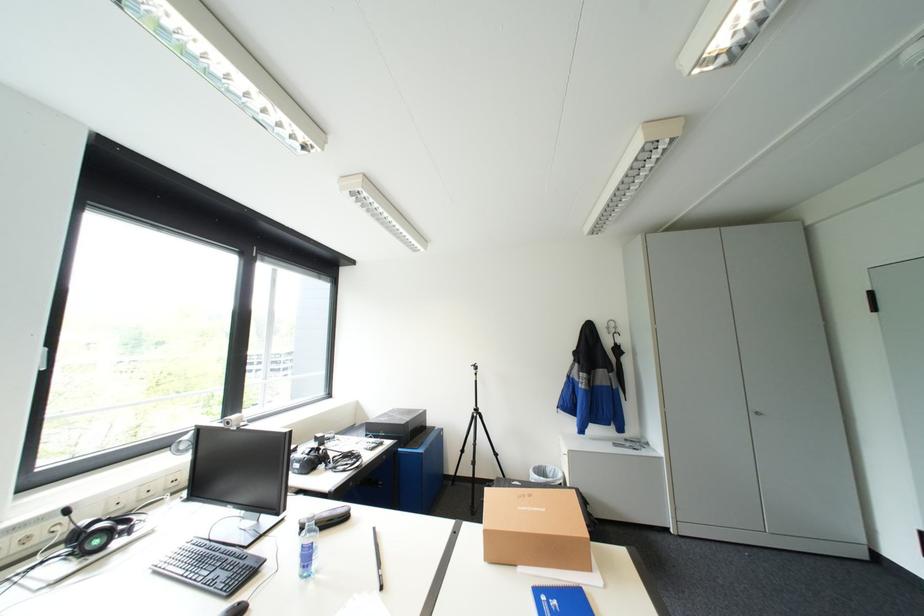
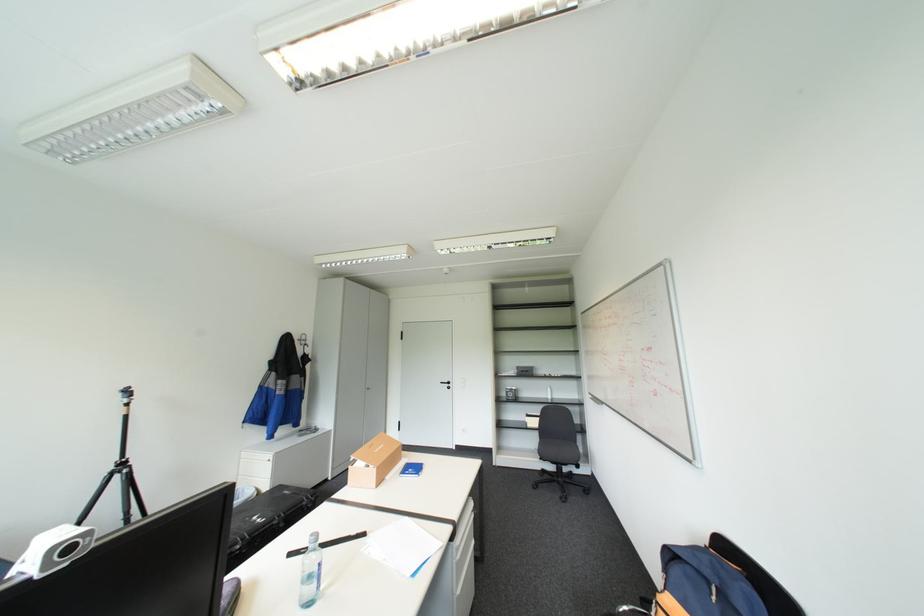
Find the pixel in the second image that matches (x=575, y=456) in the first image.

(278, 461)